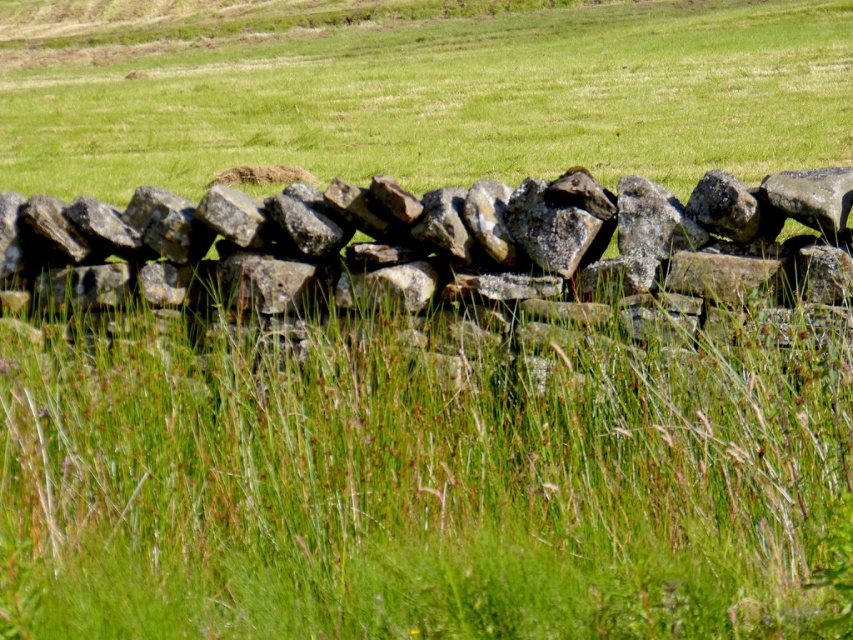
You are a gardener trying to maintain a path between the green grass at center and the rough stone wall at center. Based on their widths, which area should you prioritize for trimming to keep the path clear?

The green grass at center might be wider than the rough stone wall at center, so you should prioritize trimming the green grass at center to maintain the path width.

You are a gardener assessing the landscape. You notice the green grass at center and the rough stone wall at center. Which object is taller?

The green grass at center is taller than the rough stone wall at center.

You are standing in front of the dry stone wall and want to take a photo. There are two points marked on the wall at coordinates point (77, 97) and point (466, 328). Which point is closer to your camera lens?

Point (77, 97) is further to the camera than point (466, 328), so the point closer to your camera lens is point (466, 328).